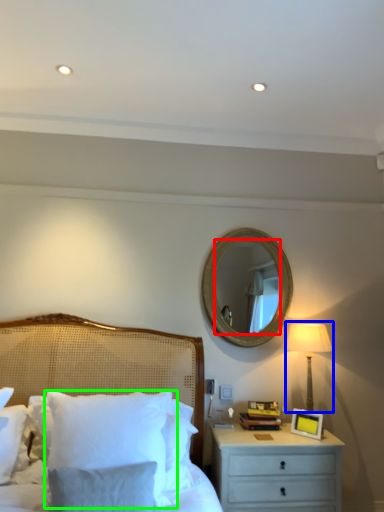
Question: Which object is positioned closest to mirror (highlighted by a red box)? Select from bedside lamp (highlighted by a blue box) and pillow (highlighted by a green box).

Choices:
 (A) bedside lamp
 (B) pillow

Answer: (A)